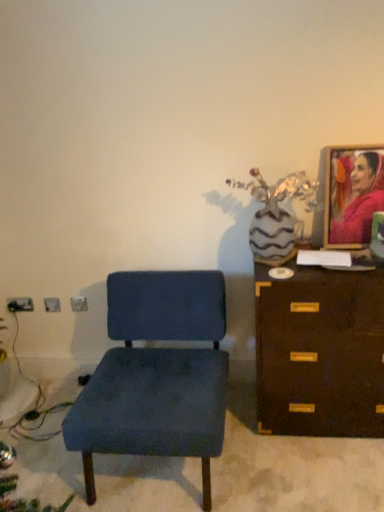
Question: Is matte pink fabric portrait at upper right bigger than velvet blue chair at center?

Choices:
 (A) no
 (B) yes

Answer: (A)

Question: From the image's perspective, is matte pink fabric portrait at upper right located beneath velvet blue chair at center?

Choices:
 (A) yes
 (B) no

Answer: (B)

Question: Does matte pink fabric portrait at upper right have a greater width compared to velvet blue chair at center?

Choices:
 (A) yes
 (B) no

Answer: (B)

Question: Does matte pink fabric portrait at upper right have a greater height compared to velvet blue chair at center?

Choices:
 (A) no
 (B) yes

Answer: (A)

Question: Does matte pink fabric portrait at upper right come in front of velvet blue chair at center?

Choices:
 (A) no
 (B) yes

Answer: (A)

Question: Choose the correct answer: Is velvet blue chair at center inside brown wooden chest of drawers at right or outside it?

Choices:
 (A) inside
 (B) outside

Answer: (B)

Question: From a real-world perspective, relative to brown wooden chest of drawers at right, is velvet blue chair at center vertically above or below?

Choices:
 (A) below
 (B) above

Answer: (A)

Question: Considering the positions of velvet blue chair at center and brown wooden chest of drawers at right in the image, is velvet blue chair at center taller or shorter than brown wooden chest of drawers at right?

Choices:
 (A) tall
 (B) short

Answer: (B)

Question: In terms of width, does velvet blue chair at center look wider or thinner when compared to brown wooden chest of drawers at right?

Choices:
 (A) wide
 (B) thin

Answer: (A)

Question: Considering the relative positions of brown wooden chest of drawers at right and velvet blue chair at center in the image provided, is brown wooden chest of drawers at right to the left or to the right of velvet blue chair at center?

Choices:
 (A) left
 (B) right

Answer: (B)

Question: In the image, is brown wooden chest of drawers at right positioned in front of or behind velvet blue chair at center?

Choices:
 (A) front
 (B) behind

Answer: (B)

Question: From a real-world perspective, is brown wooden chest of drawers at right above or below velvet blue chair at center?

Choices:
 (A) below
 (B) above

Answer: (B)

Question: From the image's perspective, is brown wooden chest of drawers at right above or below velvet blue chair at center?

Choices:
 (A) above
 (B) below

Answer: (A)

Question: Is point (155, 272) closer or farther from the camera than point (367, 208)?

Choices:
 (A) closer
 (B) farther

Answer: (B)

Question: From the image's perspective, is velvet blue chair at center located above or below matte pink fabric portrait at upper right?

Choices:
 (A) above
 (B) below

Answer: (B)